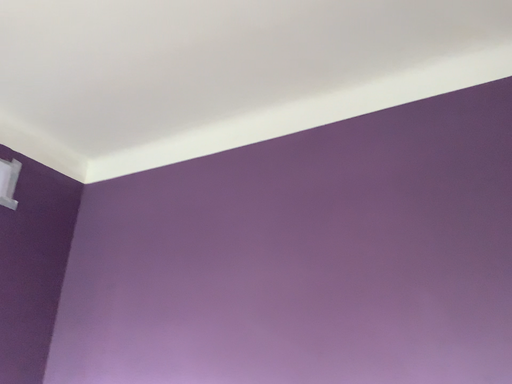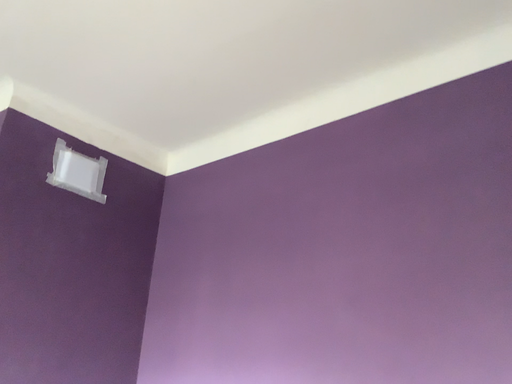
Question: Which way did the camera rotate in the video?

Choices:
 (A) rotated left
 (B) rotated right

Answer: (A)